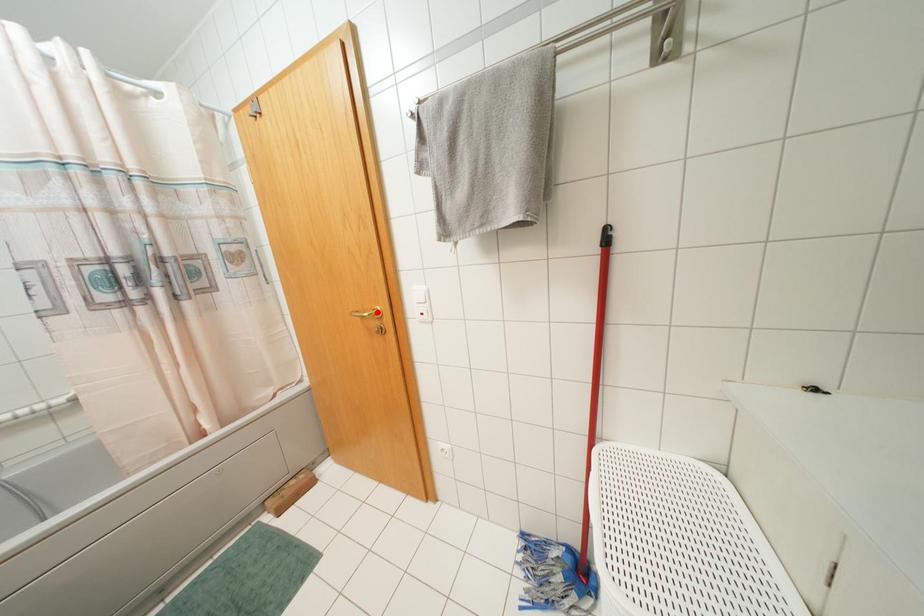
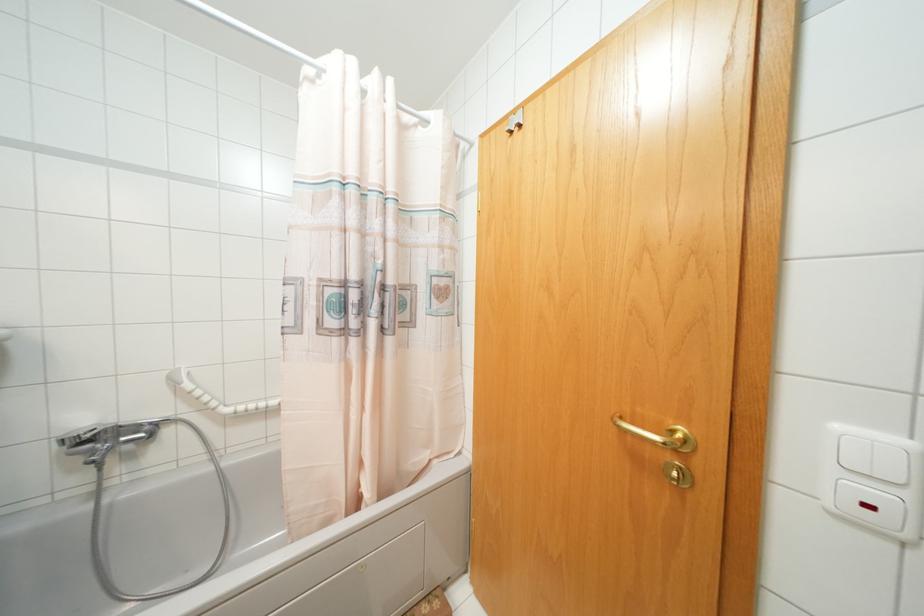
Where in the second image is the point corresponding to the highlighted location from the first image?

(686, 440)